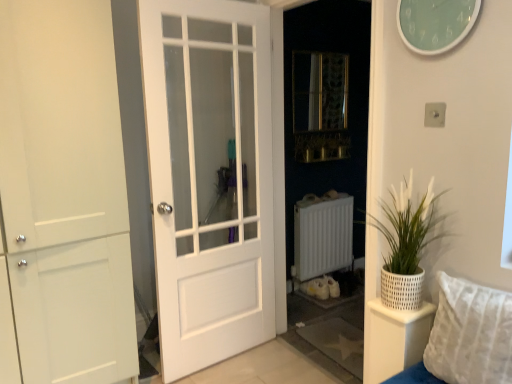
I want to click on free space above white matte radiator at center (from a real-world perspective), so click(322, 196).